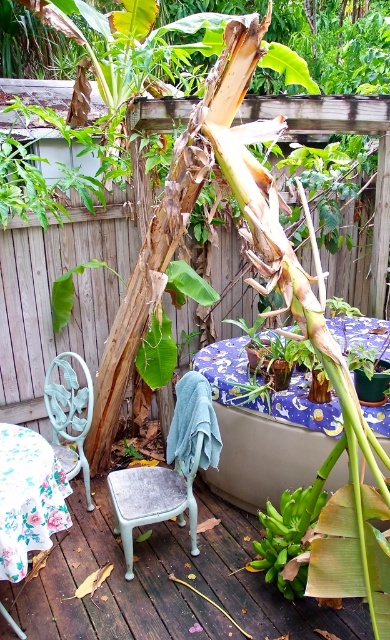
Question: Does wooden deck at center appear on the left side of light blue painted metal chair at lower left?

Choices:
 (A) yes
 (B) no

Answer: (B)

Question: Is wooden deck at center bigger than light blue painted metal chair at lower left?

Choices:
 (A) no
 (B) yes

Answer: (B)

Question: Based on their relative distances, which object is farther from the wooden deck at center?

Choices:
 (A) teal fabric stool at lower left
 (B) wooden fence at upper center

Answer: (B)

Question: Based on their relative distances, which object is farther from the light blue painted metal chair at lower left?

Choices:
 (A) wooden deck at center
 (B) teal fabric stool at lower left
 (C) wooden fence at upper center

Answer: (A)

Question: Considering the real-world distances, which object is closest to the teal fabric stool at lower left?

Choices:
 (A) light blue painted metal chair at lower left
 (B) wooden fence at upper center

Answer: (A)

Question: Is wooden deck at center below teal fabric stool at lower left?

Choices:
 (A) yes
 (B) no

Answer: (A)